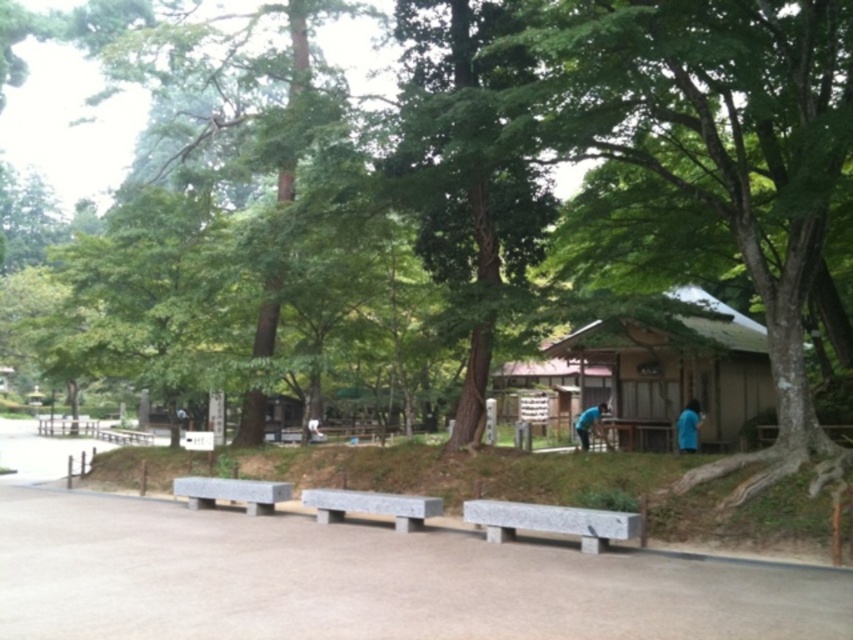
Question: Is wooden hut at right positioned at the back of gray granite bench at center?

Choices:
 (A) no
 (B) yes

Answer: (B)

Question: Which point is closer to the camera?

Choices:
 (A) (611, 332)
 (B) (415, 209)

Answer: (A)

Question: Which of the following is the farthest from the observer?

Choices:
 (A) blue fabric shirt at lower right
 (B) gray stone bench at lower center
 (C) gray stone bench at center

Answer: (A)

Question: Does green leafy tree at center appear over wooden picnic table at center?

Choices:
 (A) no
 (B) yes

Answer: (B)

Question: Is gray granite bench at center to the right of wooden picnic table at center from the viewer's perspective?

Choices:
 (A) no
 (B) yes

Answer: (A)

Question: Which object is closer to the camera taking this photo?

Choices:
 (A) blue fabric shirt at lower right
 (B) gray stone bench at lower center
 (C) wooden hut at right
 (D) green leafy tree at center

Answer: (D)